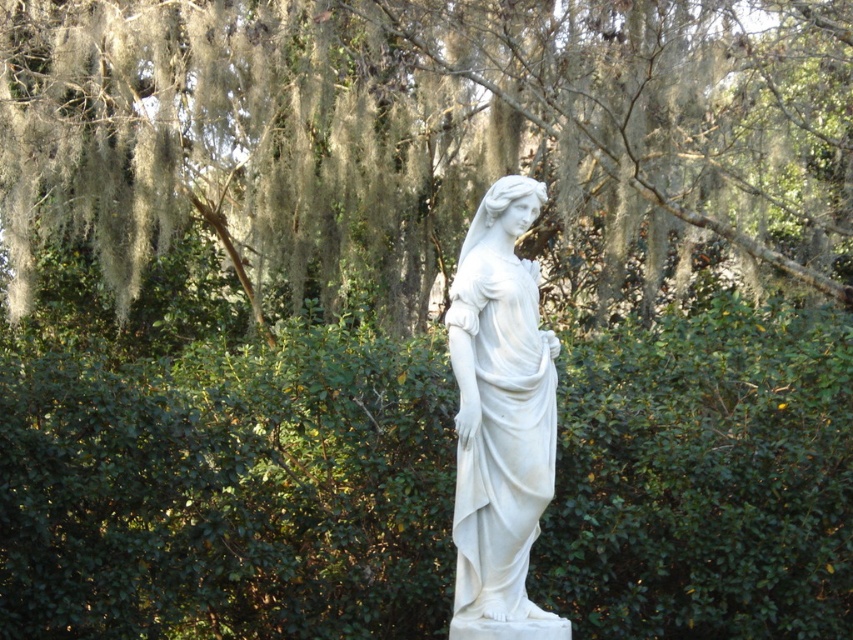
Who is higher up, green mossy tree at center or white marble statue at center?

green mossy tree at center

Between point (512, 44) and point (532, 486), which one is positioned in front?

Point (532, 486)

In order to click on green mossy tree at center in this screenshot , I will do `click(427, 134)`.